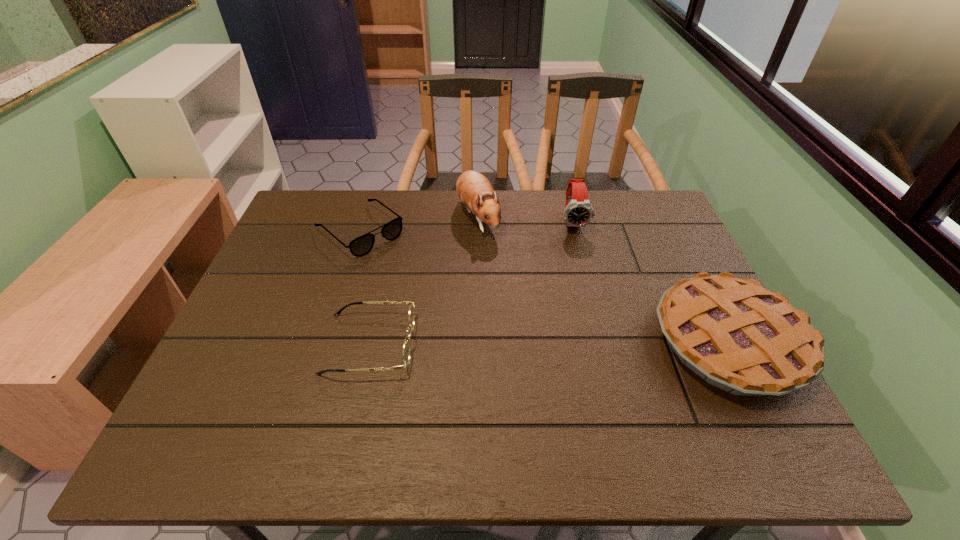
Locate an element on the screen. The width and height of the screenshot is (960, 540). free space on the desktop that is between the nearer spectacles and the pie and is positioned at the face of the hamster is located at coordinates (538, 342).

At what (x,y) coordinates should I click in order to perform the action: click on free spot on the desktop that is between the nearer spectacles and the pie and is positioned on the face of the second object from right to left. Please return your answer as a coordinate pair (x, y). Looking at the image, I should click on (601, 342).

Find the location of `vacant space on the desktop that is between the nearer spectacles and the rightmost object and is positioned on the front-facing side of the farther spectacles`. vacant space on the desktop that is between the nearer spectacles and the rightmost object and is positioned on the front-facing side of the farther spectacles is located at coordinates (498, 343).